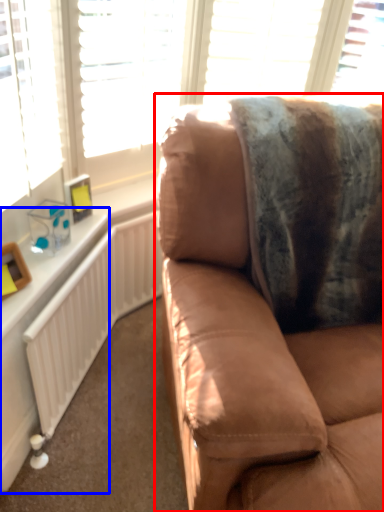
Question: Which object is further to the camera taking this photo, studio couch (highlighted by a red box) or table (highlighted by a blue box)?

Choices:
 (A) studio couch
 (B) table

Answer: (B)